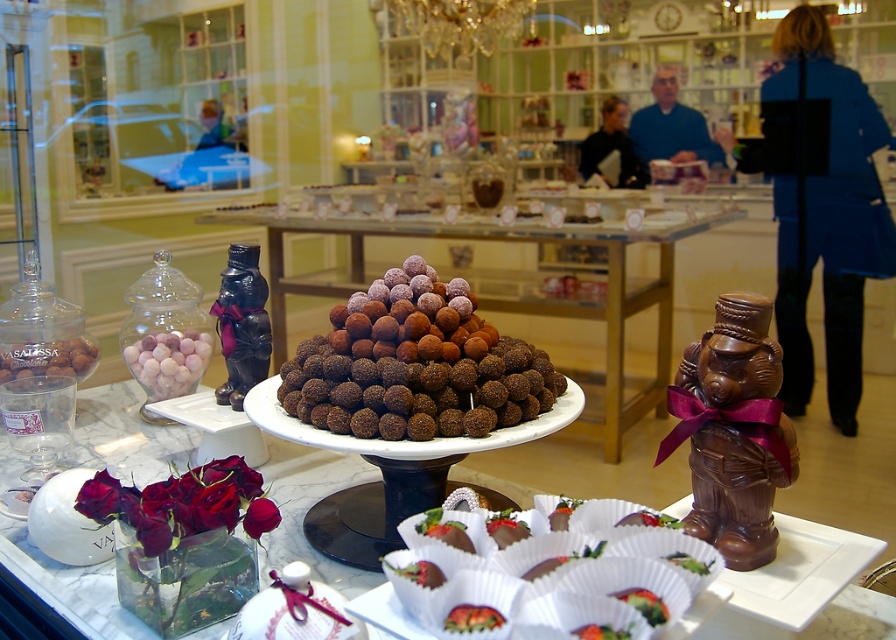
Question: Which object is the farthest from the clear glass jar at upper left?

Choices:
 (A) brown chocolate truffles at center
 (B) shiny chocolate bear at right

Answer: (B)

Question: Is chocolate truffles at center below smooth black coat at upper center?

Choices:
 (A) no
 (B) yes

Answer: (B)

Question: Based on their relative distances, which object is farther from the smooth black coat at upper center?

Choices:
 (A) shiny chocolate bear at right
 (B) chocolate truffles at center

Answer: (B)

Question: From the image, what is the correct spatial relationship of shiny chocolate bear at right in relation to brown chocolate truffles at center?

Choices:
 (A) below
 (B) above

Answer: (A)

Question: Can you confirm if brown chocolate truffles at center is thinner than smooth black coat at upper center?

Choices:
 (A) yes
 (B) no

Answer: (B)

Question: Which object is closer to the camera taking this photo?

Choices:
 (A) clear glass jar at upper left
 (B) chocolate truffles at center

Answer: (B)